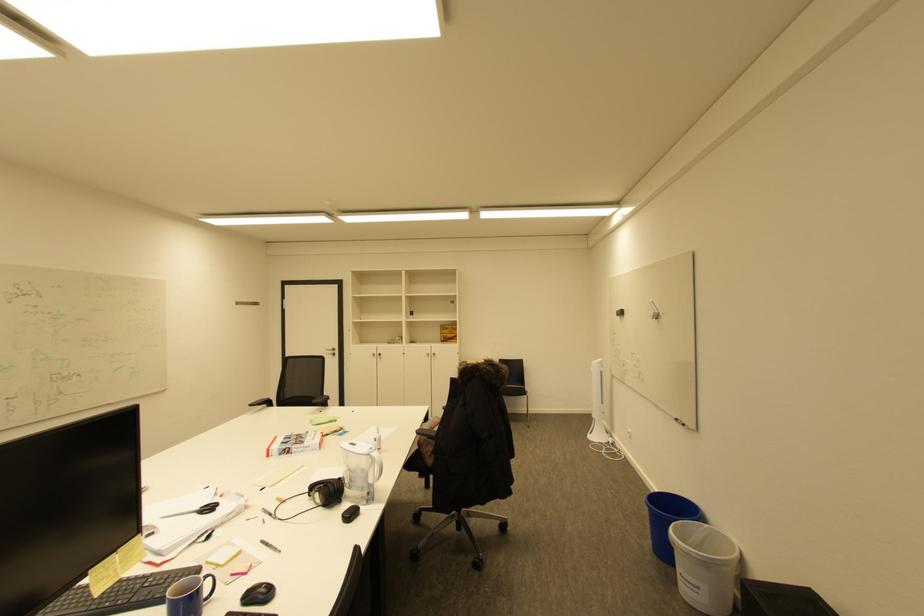
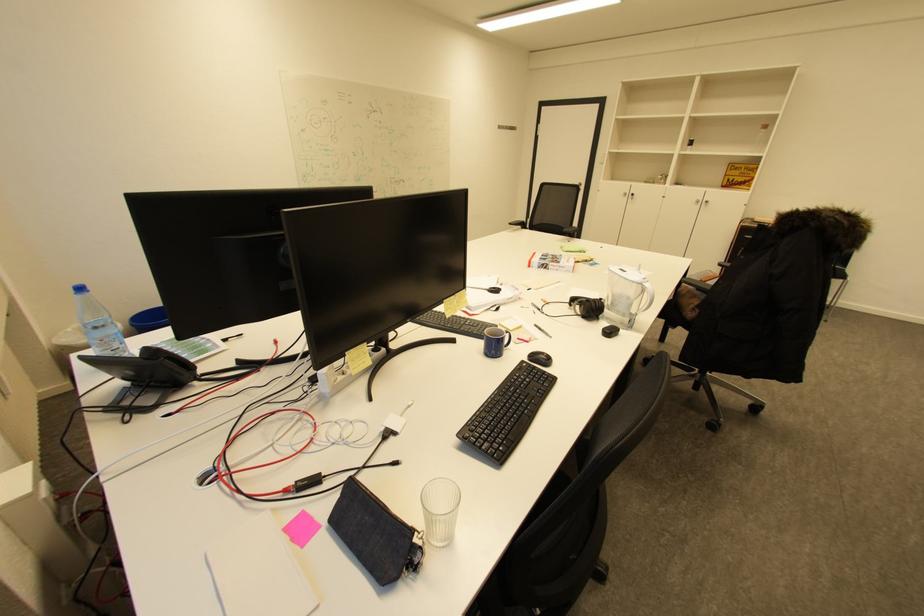
Locate, in the second image, the point that corresponds to [380,355] in the first image.

(630, 195)